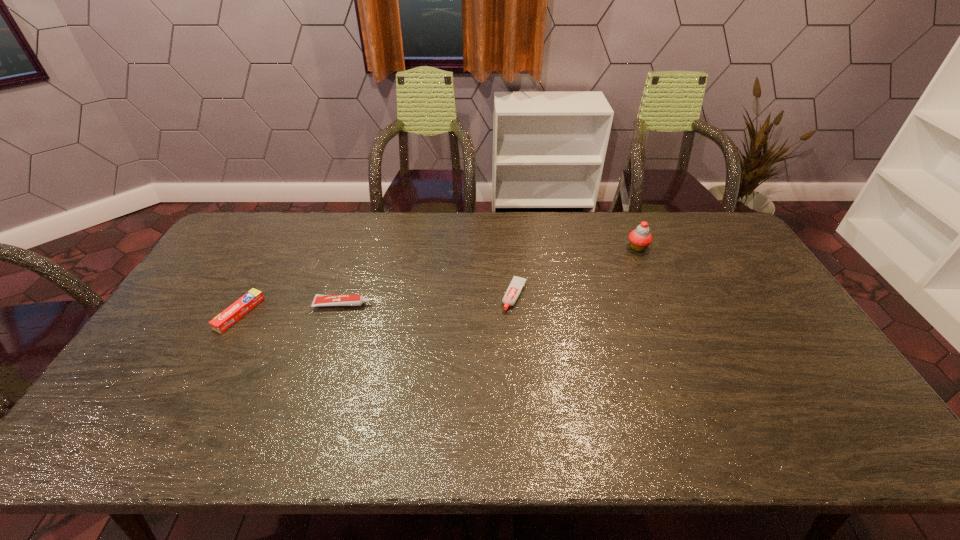
Identify the location of unoccupied position between the third object from right to left and the cupcake. This screenshot has height=540, width=960. (491, 276).

Where is `unoccupied position between the rightmost toothpaste and the leftmost object`? unoccupied position between the rightmost toothpaste and the leftmost object is located at coordinates (377, 305).

You are a GUI agent. You are given a task and a screenshot of the screen. Output one action in this format:
    pyautogui.click(x=<x>, y=<y>)
    Task: Click on the free space between the leftmost toothpaste and the cupcake
    This screenshot has height=540, width=960.
    Given the screenshot: What is the action you would take?
    pyautogui.click(x=439, y=280)

Image resolution: width=960 pixels, height=540 pixels. In order to click on unoccupied position between the second object from right to left and the leftmost toothpaste in this screenshot , I will do `click(377, 305)`.

What are the coordinates of `free point between the tallest object and the rightmost toothpaste` in the screenshot? It's located at (576, 272).

The width and height of the screenshot is (960, 540). Identify the location of unoccupied area between the rightmost toothpaste and the cupcake. (576, 272).

Select which object is the second closest to the third object from right to left. Please provide its 2D coordinates. Your answer should be formatted as a tuple, i.e. [(x, y)], where the tuple contains the x and y coordinates of a point satisfying the conditions above.

[(517, 283)]

Identify which object is located as the nearest to the leftmost object. Please provide its 2D coordinates. Your answer should be formatted as a tuple, i.e. [(x, y)], where the tuple contains the x and y coordinates of a point satisfying the conditions above.

[(320, 300)]

Locate which toothpaste is the second closest to the tallest object. Please provide its 2D coordinates. Your answer should be formatted as a tuple, i.e. [(x, y)], where the tuple contains the x and y coordinates of a point satisfying the conditions above.

[(320, 300)]

Choose which toothpaste is the third nearest neighbor to the cupcake. Please provide its 2D coordinates. Your answer should be formatted as a tuple, i.e. [(x, y)], where the tuple contains the x and y coordinates of a point satisfying the conditions above.

[(239, 308)]